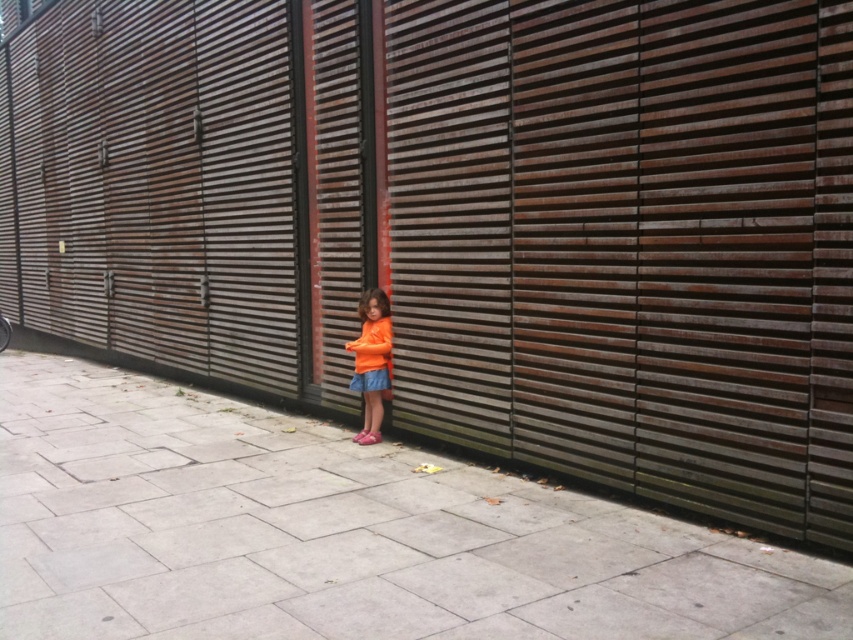
Between gray concrete pavement at center and orange matte shirt at center, which one appears on the right side from the viewer's perspective?

From the viewer's perspective, gray concrete pavement at center appears more on the right side.

From the picture: Does gray concrete pavement at center have a larger size compared to orange matte shirt at center?

Incorrect, gray concrete pavement at center is not larger than orange matte shirt at center.

Locate an element on the screen. This screenshot has width=853, height=640. gray concrete pavement at center is located at coordinates (338, 532).

Can you confirm if gray concrete pavement at center is positioned to the right of orange fabric shorts at center?

Correct, you'll find gray concrete pavement at center to the right of orange fabric shorts at center.

Which is more to the left, gray concrete pavement at center or orange fabric shorts at center?

From the viewer's perspective, orange fabric shorts at center appears more on the left side.

Identify the location of gray concrete pavement at center. This screenshot has height=640, width=853. (338, 532).

The width and height of the screenshot is (853, 640). I want to click on orange matte shirt at center, so click(x=370, y=362).

Does orange matte shirt at center appear on the left side of orange fabric shorts at center?

No, orange matte shirt at center is not to the left of orange fabric shorts at center.

Identify the location of orange matte shirt at center. The height and width of the screenshot is (640, 853). (370, 362).